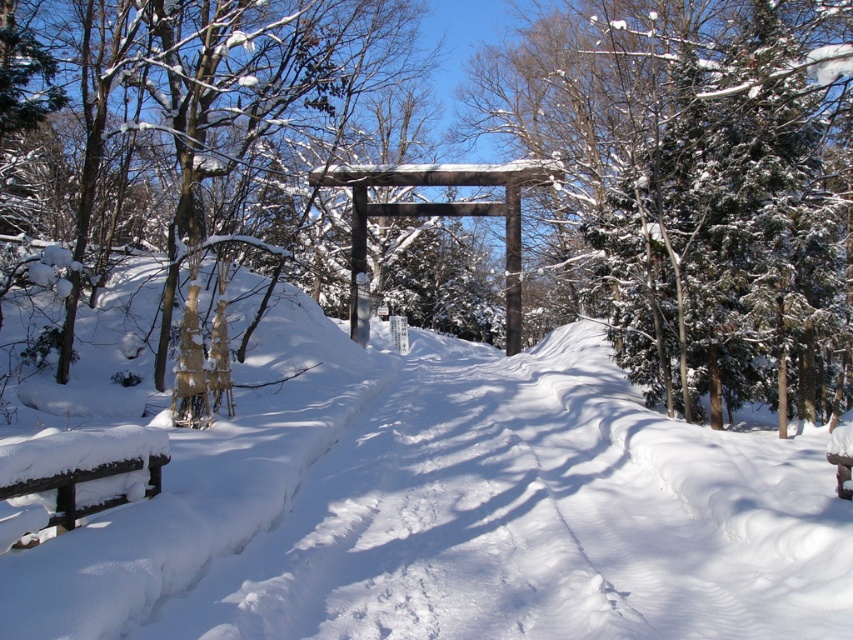
Question: Can you confirm if snow-covered tree at center is smaller than wooden bench at lower left?

Choices:
 (A) no
 (B) yes

Answer: (A)

Question: Does snow-covered tree at center appear over white fluffy snow at center?

Choices:
 (A) yes
 (B) no

Answer: (A)

Question: Which point is farther to the camera?

Choices:
 (A) wooden bench at lower left
 (B) snow-covered tree at center
 (C) white fluffy snow at center

Answer: (B)

Question: Which is nearer to the snow-covered tree at center?

Choices:
 (A) wooden bench at lower left
 (B) white fluffy snow at center

Answer: (B)

Question: Which object is farther from the camera taking this photo?

Choices:
 (A) white fluffy snow at center
 (B) snow-covered tree at center

Answer: (B)

Question: Does white fluffy snow at center have a greater width compared to wooden bench at lower left?

Choices:
 (A) yes
 (B) no

Answer: (A)